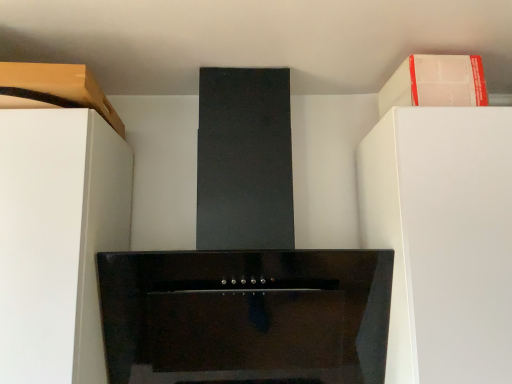
Question: Can you confirm if white matte cabinet at upper right, the 2th cabinetry when ordered from left to right, is smaller than white matte cabinet at left?

Choices:
 (A) yes
 (B) no

Answer: (A)

Question: From a real-world perspective, is white matte cabinet at upper right, the 2th cabinetry when ordered from left to right, under white matte cabinet at left?

Choices:
 (A) no
 (B) yes

Answer: (A)

Question: Is white matte cabinet at upper right, the 2th cabinetry when ordered from left to right, next to white matte cabinet at left and touching it?

Choices:
 (A) yes
 (B) no

Answer: (B)

Question: Considering the relative sizes of white matte cabinet at upper right, the 2th cabinetry when ordered from left to right, and white matte cabinet at left in the image provided, is white matte cabinet at upper right, the 2th cabinetry when ordered from left to right, bigger than white matte cabinet at left?

Choices:
 (A) yes
 (B) no

Answer: (B)

Question: Considering the relative sizes of white matte cabinet at upper right, the 2th cabinetry when ordered from left to right, and white matte cabinet at left in the image provided, is white matte cabinet at upper right, the 2th cabinetry when ordered from left to right, wider than white matte cabinet at left?

Choices:
 (A) no
 (B) yes

Answer: (A)

Question: In terms of width, does matte wood cabinet at upper left, which is counted as the first cabinetry, starting from the left, look wider or thinner when compared to white matte cabinet at upper right, acting as the first cabinetry starting from the right?

Choices:
 (A) thin
 (B) wide

Answer: (B)

Question: From the image's perspective, is matte wood cabinet at upper left, which is counted as the first cabinetry, starting from the left, positioned above or below white matte cabinet at upper right, acting as the first cabinetry starting from the right?

Choices:
 (A) below
 (B) above

Answer: (A)

Question: From a real-world perspective, is matte wood cabinet at upper left, which is counted as the first cabinetry, starting from the left, positioned above or below white matte cabinet at upper right, the 2th cabinetry when ordered from left to right?

Choices:
 (A) above
 (B) below

Answer: (B)

Question: Choose the correct answer: Is matte wood cabinet at upper left, placed as the 2th cabinetry when sorted from right to left, inside white matte cabinet at upper right, the 2th cabinetry when ordered from left to right, or outside it?

Choices:
 (A) outside
 (B) inside

Answer: (A)

Question: Is white matte cabinet at upper right, acting as the first cabinetry starting from the right, inside the boundaries of white matte cabinet at left, or outside?

Choices:
 (A) outside
 (B) inside

Answer: (A)

Question: Considering their positions, is white matte cabinet at upper right, the 2th cabinetry when ordered from left to right, located in front of or behind white matte cabinet at left?

Choices:
 (A) front
 (B) behind

Answer: (B)

Question: Does point (480, 104) appear closer or farther from the camera than point (74, 206)?

Choices:
 (A) farther
 (B) closer

Answer: (A)

Question: Considering the positions of white matte cabinet at upper right, acting as the first cabinetry starting from the right, and white matte cabinet at left in the image, is white matte cabinet at upper right, acting as the first cabinetry starting from the right, bigger or smaller than white matte cabinet at left?

Choices:
 (A) small
 (B) big

Answer: (A)

Question: Is white matte cabinet at left situated inside matte wood cabinet at upper left, placed as the 2th cabinetry when sorted from right to left, or outside?

Choices:
 (A) inside
 (B) outside

Answer: (B)

Question: Is white matte cabinet at left bigger or smaller than matte wood cabinet at upper left, placed as the 2th cabinetry when sorted from right to left?

Choices:
 (A) big
 (B) small

Answer: (A)